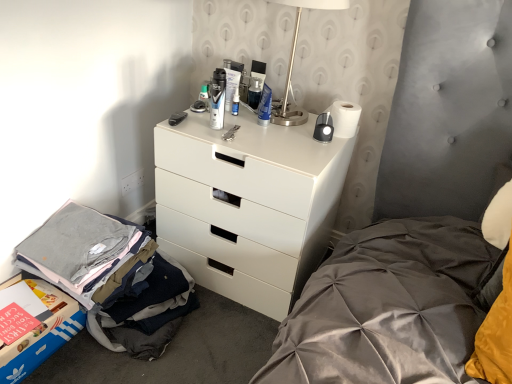
The width and height of the screenshot is (512, 384). What are the coordinates of `empty space that is ontop of white matte chest of drawers at center` in the screenshot? It's located at (264, 124).